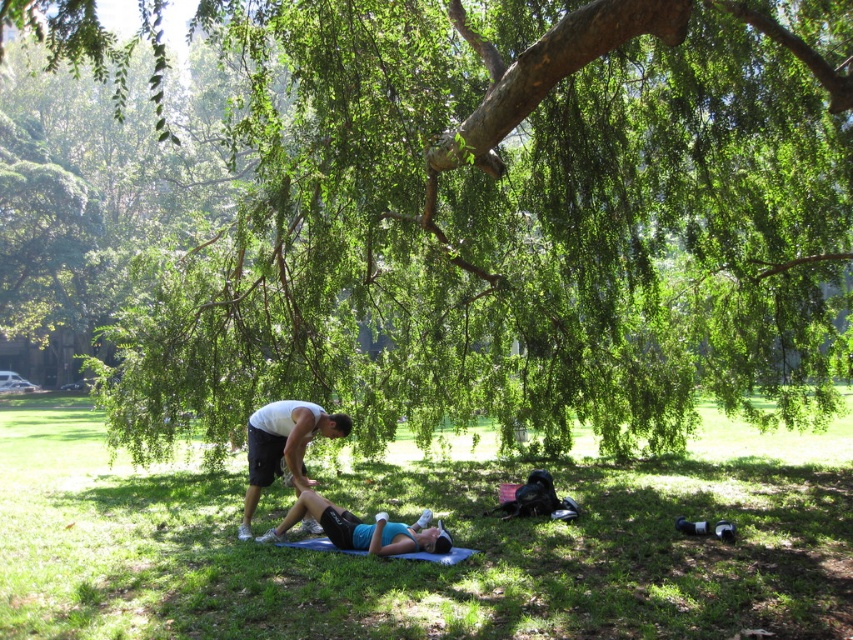
Does white matte shirt at center have a greater width compared to blue fabric mat at lower center?

No.

Is point (277, 412) positioned after point (364, 548)?

Yes.

Who is more distant from viewer, (x=347, y=426) or (x=381, y=525)?

The point (x=347, y=426) is behind.

This screenshot has width=853, height=640. In order to click on white matte shirt at center in this screenshot , I will do `click(283, 445)`.

Who is taller, green grass at lower center or white matte shirt at center?

white matte shirt at center

Between green grass at lower center and white matte shirt at center, which one is positioned lower?

green grass at lower center is lower down.

Locate an element on the screen. The image size is (853, 640). green grass at lower center is located at coordinates (430, 564).

Find the location of `green grass at lower center`. green grass at lower center is located at coordinates (430, 564).

Does green grass at lower center have a smaller size compared to blue fabric mat at lower center?

No.

Is green grass at lower center positioned behind blue fabric mat at lower center?

No, green grass at lower center is in front of blue fabric mat at lower center.

Who is more distant from viewer, (296, 552) or (321, 524)?

Point (321, 524)

Identify the location of green grass at lower center. The image size is (853, 640). (430, 564).